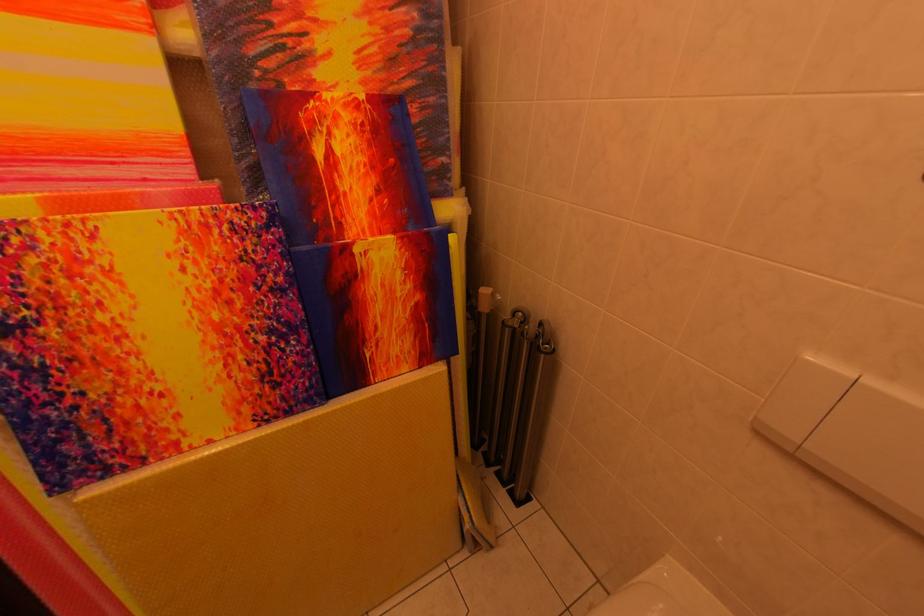
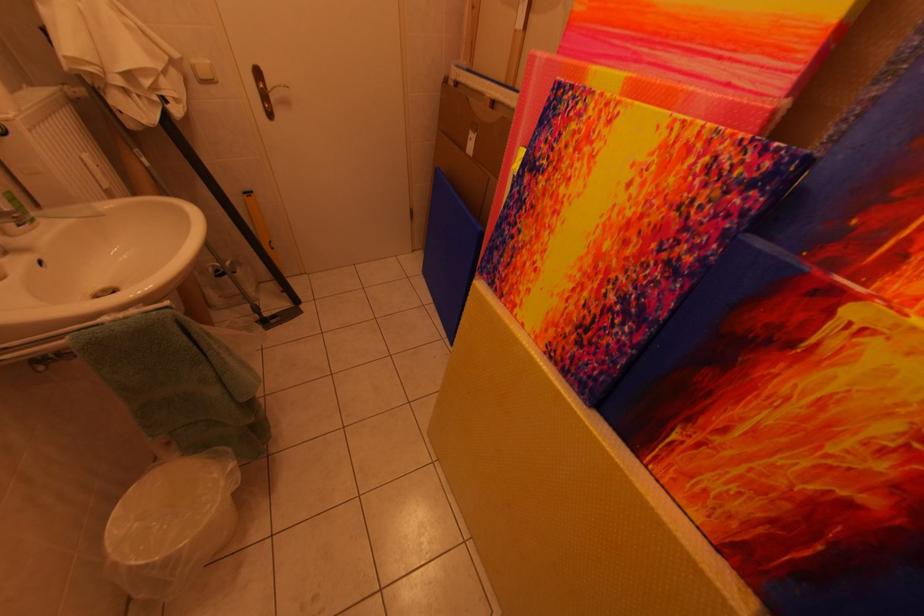
Where in the second image is the point corresponding to pixel 366 254 from the first image?

(861, 317)